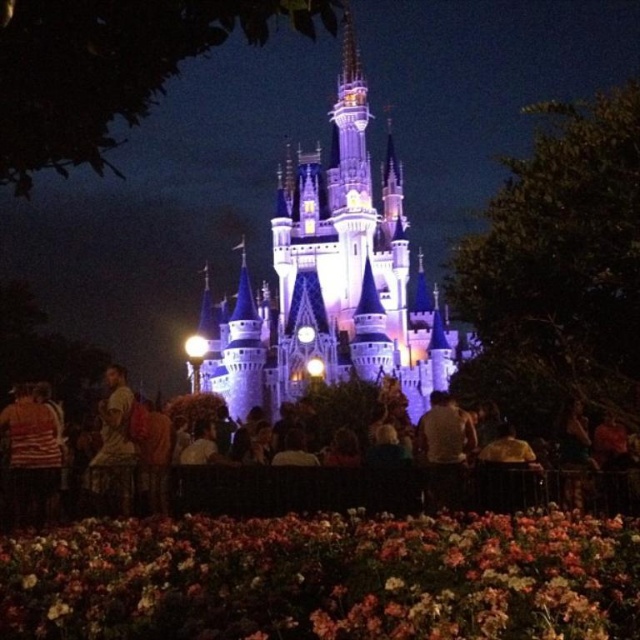
Between point (268, 525) and point (269, 323), which one is positioned behind?

The point (269, 323) is more distant.

Is multicolored fabric flowers at lower center above illuminated stone castle at center?

Actually, multicolored fabric flowers at lower center is below illuminated stone castle at center.

Locate an element on the screen. multicolored fabric flowers at lower center is located at coordinates (324, 579).

From the picture: Who is shorter, illuminated stone castle at center or dark brown leather jacket at lower left?

dark brown leather jacket at lower left is shorter.

Is illuminated stone castle at center wider than dark brown leather jacket at lower left?

Correct, the width of illuminated stone castle at center exceeds that of dark brown leather jacket at lower left.

Locate an element on the screen. illuminated stone castle at center is located at coordinates (330, 280).

Does point (611, 557) lie in front of point (262, 467)?

Yes, point (611, 557) is in front of point (262, 467).

Does point (35, 620) lie in front of point (616, 476)?

Yes.

This screenshot has height=640, width=640. What are the coordinates of `multicolored fabric flowers at lower center` in the screenshot? It's located at click(324, 579).